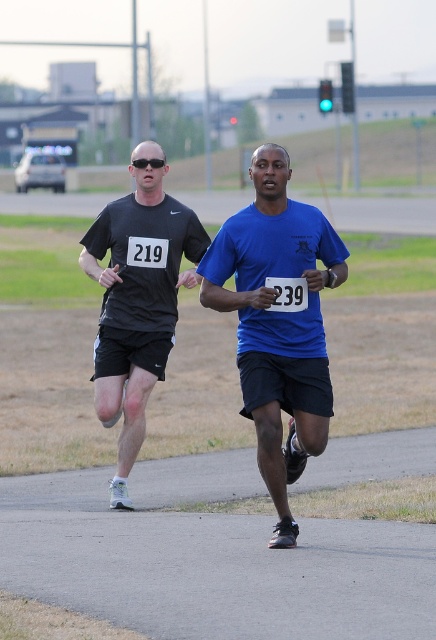
Does blue matte shirt at center appear on the left side of matte black shirt at left?

In fact, blue matte shirt at center is to the right of matte black shirt at left.

Does blue matte shirt at center come in front of matte black shirt at left?

Yes, blue matte shirt at center is closer to the viewer.

The image size is (436, 640). Identify the location of blue matte shirt at center. (278, 321).